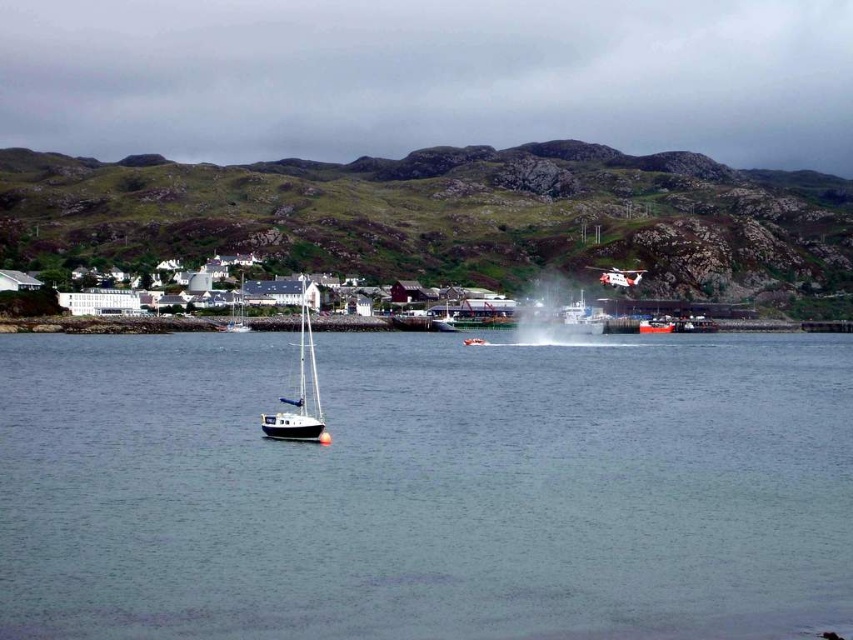
Question: Estimate the real-world distances between objects in this image. Which object is farther from the white glossy sailboat at center?

Choices:
 (A) white matte boat at center
 (B) clear water at center
 (C) white matte sailboat at center
 (D) blue matte sailboat at center

Answer: (B)

Question: Based on their relative distances, which object is nearer to the white matte boat at center?

Choices:
 (A) clear water at center
 (B) white matte sailboat at center

Answer: (B)

Question: Can you confirm if clear water at center is positioned to the right of red glossy boat at center?

Choices:
 (A) no
 (B) yes

Answer: (A)

Question: Is blue matte sailboat at center further to the viewer compared to red glossy boat at center?

Choices:
 (A) no
 (B) yes

Answer: (A)

Question: Estimate the real-world distances between objects in this image. Which object is closer to the white matte sailboat at center?

Choices:
 (A) blue matte sailboat at center
 (B) red glossy boat at center
 (C) white matte boat at center
 (D) white glossy sailboat at center

Answer: (A)

Question: Is blue matte sailboat at center to the right of white glossy sailboat at center from the viewer's perspective?

Choices:
 (A) yes
 (B) no

Answer: (B)